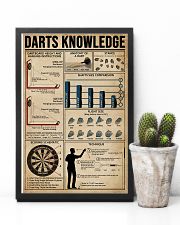
At what (x,y) coordinates should I click in order to perform the action: click on white surface. Please return your answer as a coordinate pair (x, y). Looking at the image, I should click on (73, 213).